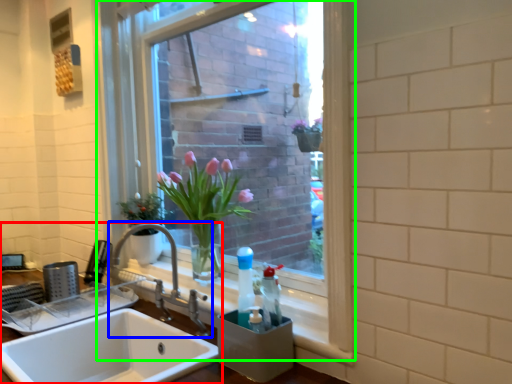
Question: Which is nearer to the sink (highlighted by a red box)? tap (highlighted by a blue box) or window (highlighted by a green box).

Choices:
 (A) tap
 (B) window

Answer: (A)